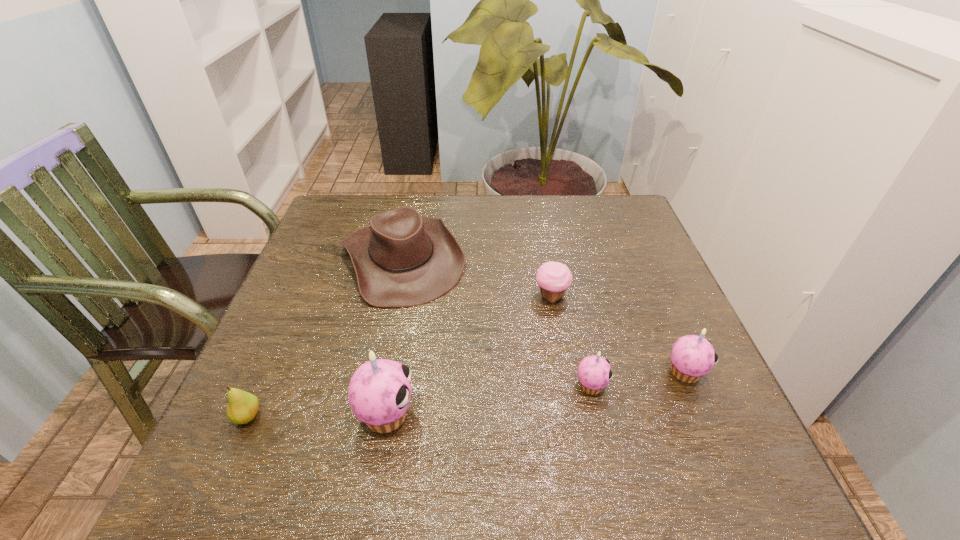
Locate an element on the screen. object that can be found as the fourth closest to the leftmost cupcake is located at coordinates (553, 278).

You are a GUI agent. You are given a task and a screenshot of the screen. Output one action in this format:
    pyautogui.click(x=<x>, y=<y>)
    Task: Click on the second closest cupcake to the rightmost object
    
    Given the screenshot: What is the action you would take?
    pyautogui.click(x=553, y=278)

Identify which cupcake is located as the nearest to the tallest cupcake. Please provide its 2D coordinates. Your answer should be formatted as a tuple, i.e. [(x, y)], where the tuple contains the x and y coordinates of a point satisfying the conditions above.

[(594, 373)]